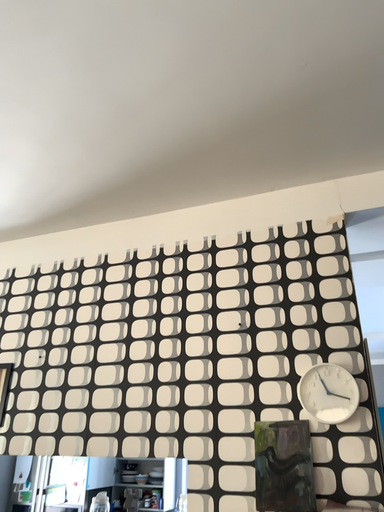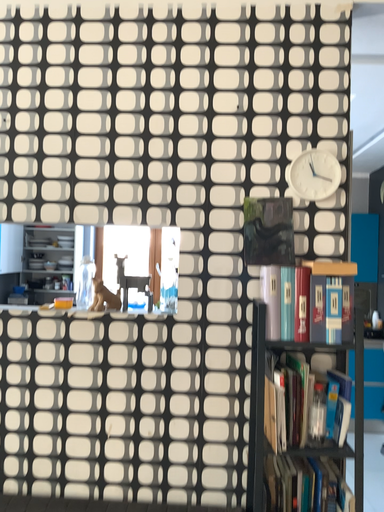
Question: How did the camera likely rotate when shooting the video?

Choices:
 (A) rotated right
 (B) rotated left

Answer: (A)